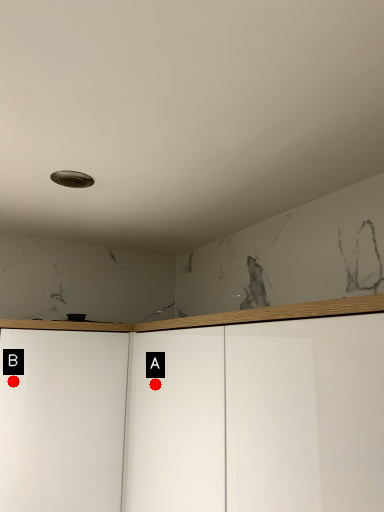
Question: Two points are circled on the image, labeled by A and B beside each circle. Which point is closer to the camera?

Choices:
 (A) A is closer
 (B) B is closer

Answer: (A)